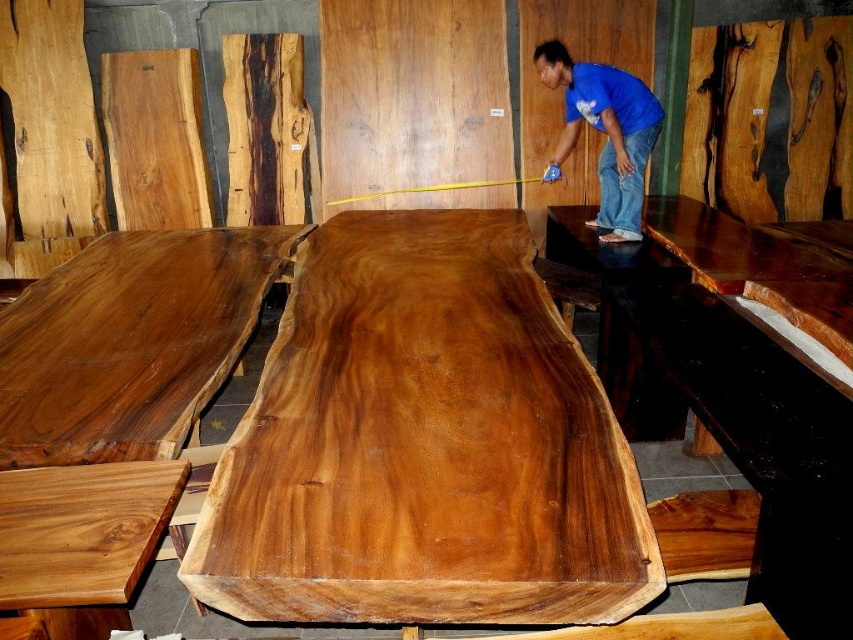
Does satin wood table at center have a lesser height compared to blue cotton shirt at upper center?

Correct, satin wood table at center is not as tall as blue cotton shirt at upper center.

Find the location of `satin wood table at center`. satin wood table at center is located at coordinates (422, 444).

The width and height of the screenshot is (853, 640). In order to click on satin wood table at center in this screenshot , I will do `click(422, 444)`.